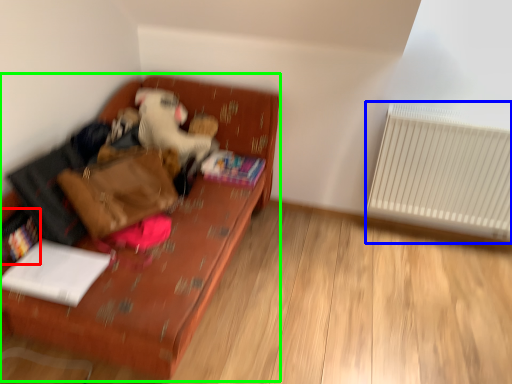
Question: Which object is positioned closest to book (highlighted by a red box)? Select from radiator (highlighted by a blue box) and furniture (highlighted by a green box).

Choices:
 (A) radiator
 (B) furniture

Answer: (B)